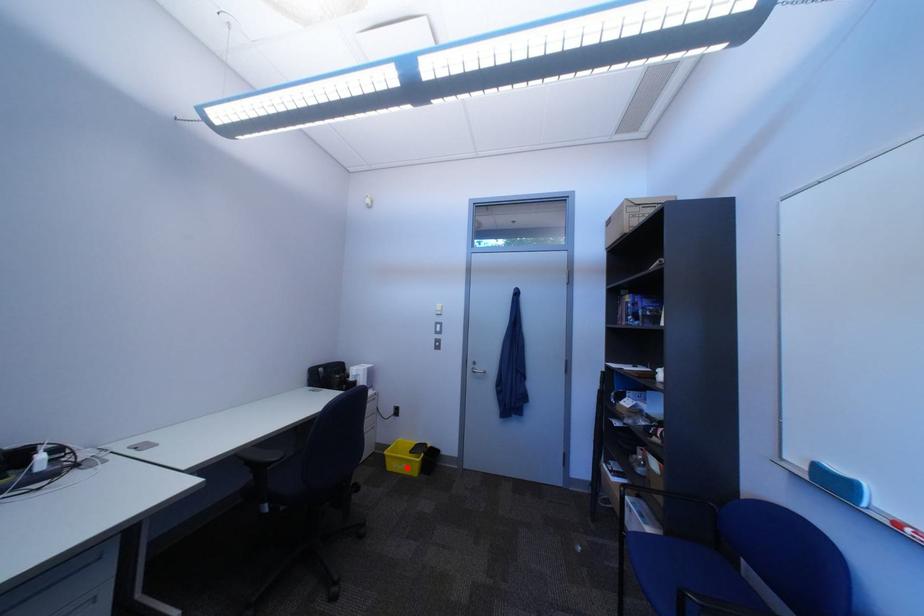
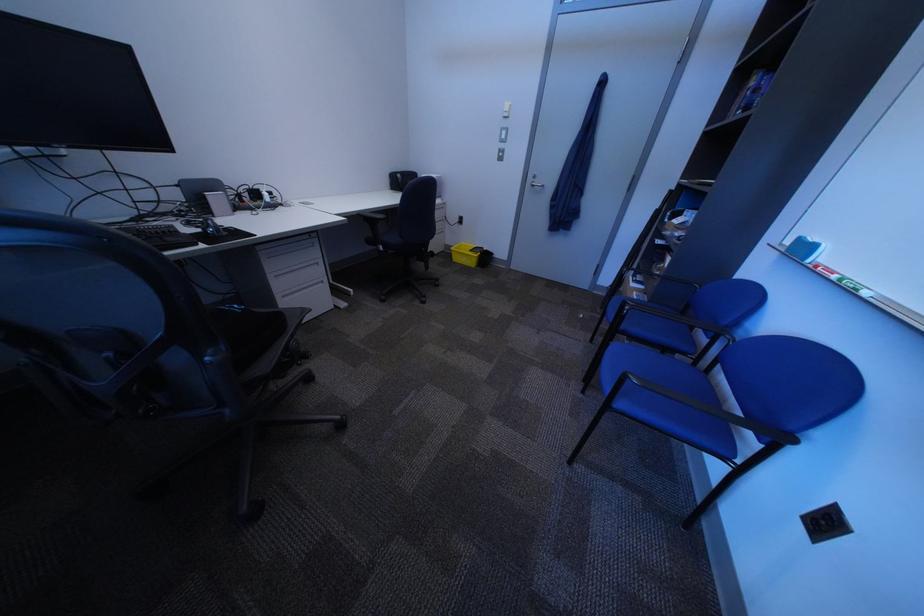
In the second image, find the point that corresponds to the highlighted location in the first image.

(470, 261)